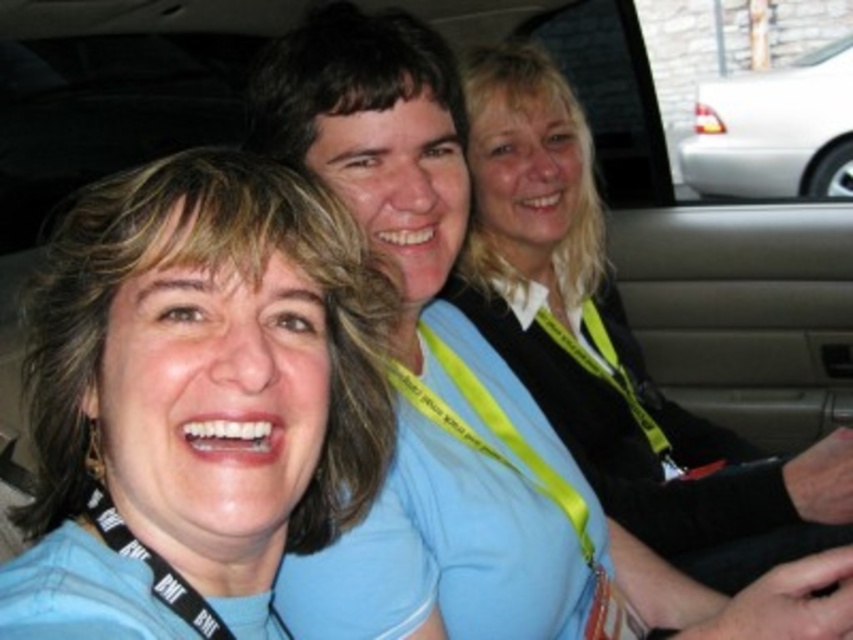
You are a photographer trying to capture a group photo of the blue fabric face at center and the white glossy car at upper right. Which object will appear wider in the photo?

The white glossy car at upper right will appear wider in the photo because it has a greater width than the blue fabric face at center according to the description.

The scene shows three people in a car. There is a point marked at coordinates (613, 346). What object is located at that point?

The point at coordinates (613, 346) marks the black sweater at center.